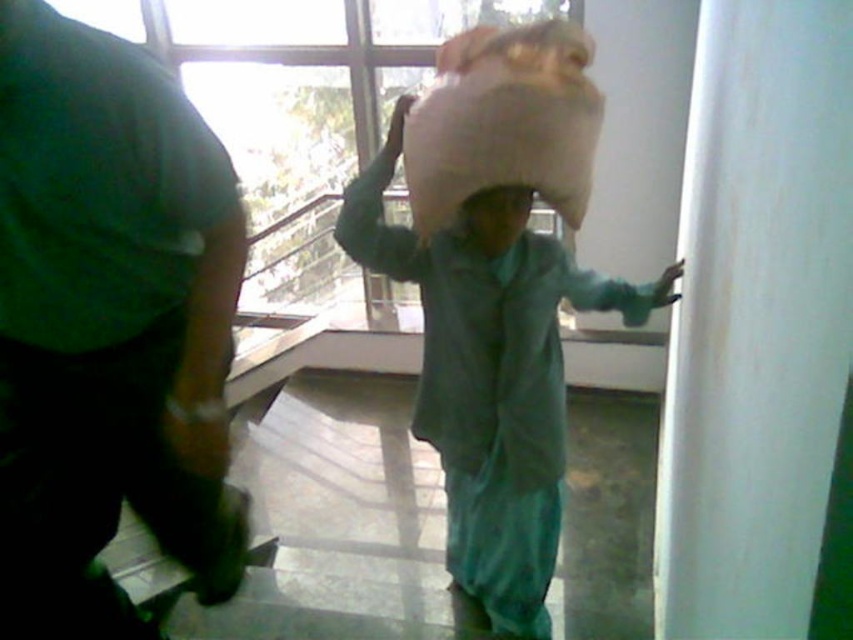
Question: Can you confirm if green matte shirt at left is positioned to the right of matte green head at center?

Choices:
 (A) yes
 (B) no

Answer: (B)

Question: Which object is positioned farthest from the matte green head at center?

Choices:
 (A) beige fabric sack at center
 (B) green matte shirt at left

Answer: (B)

Question: Which object appears farthest from the camera in this image?

Choices:
 (A) beige fabric sack at center
 (B) matte green head at center
 (C) green matte shirt at left

Answer: (A)

Question: Is green matte shirt at left below beige fabric sack at center?

Choices:
 (A) yes
 (B) no

Answer: (A)

Question: Is the position of beige fabric sack at center less distant than that of matte green head at center?

Choices:
 (A) no
 (B) yes

Answer: (A)

Question: Which point is closer to the camera?

Choices:
 (A) beige fabric sack at center
 (B) matte green head at center

Answer: (B)